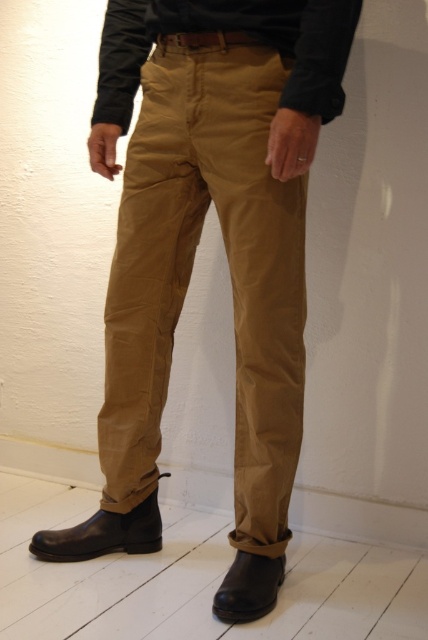
Question: Does matte black shirt at center appear over black leather boot at lower left?

Choices:
 (A) no
 (B) yes

Answer: (B)

Question: Which of the following is the closest to the observer?

Choices:
 (A) tan cotton pants at center
 (B) black leather boot at lower center
 (C) black leather boot at lower left

Answer: (A)

Question: Is matte black shirt at center thinner than black leather boot at lower left?

Choices:
 (A) no
 (B) yes

Answer: (A)

Question: Estimate the real-world distances between objects in this image. Which object is farther from the black leather boot at lower center?

Choices:
 (A) black leather boot at lower left
 (B) tan cotton pants at center
 (C) matte black shirt at center

Answer: (C)

Question: Which object is positioned closest to the black leather boot at lower center?

Choices:
 (A) tan cotton pants at center
 (B) black leather boot at lower left
 (C) matte black shirt at center

Answer: (B)

Question: Can you confirm if matte black shirt at center is wider than black leather boot at lower left?

Choices:
 (A) no
 (B) yes

Answer: (B)